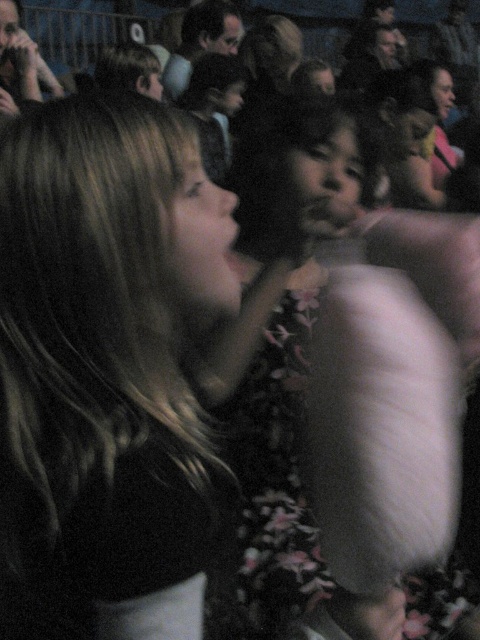
You are a photographer trying to capture a clear shot of the dark brown hair at center and the fluffy white dress at center. Based on their heights, which object should you focus on first if you want to ensure both are in frame without adjusting your camera angle?

The dark brown hair at center has a lesser height compared to the fluffy white dress at center, so you should focus on the fluffy white dress at center first to ensure it stays in frame while adjusting for the shorter dark brown hair at center.

You are a photographer trying to capture a candid shot of the dark brown hair at center and the fluffy white dress at center. If your camera has a minimum focus distance of 12 inches, will you be able to take a clear photo of both subjects without moving closer?

The distance between dark brown hair at center and fluffy white dress at center is 14.38 inches. Since the minimum focus distance is 12 inches, the camera can focus clearly on both subjects as the distance is sufficient.